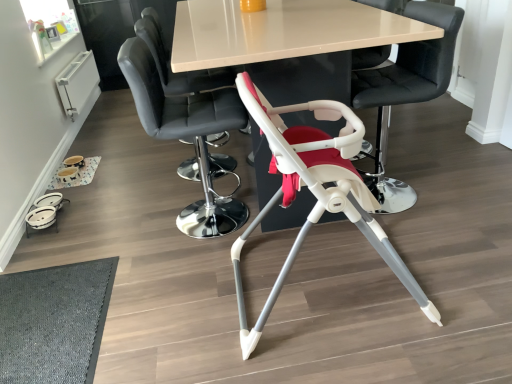
Find the location of a particular element. This screenshot has height=384, width=512. vacant space behind smooth black chair at center, which is the 3th chair in right-to-left order is located at coordinates (202, 185).